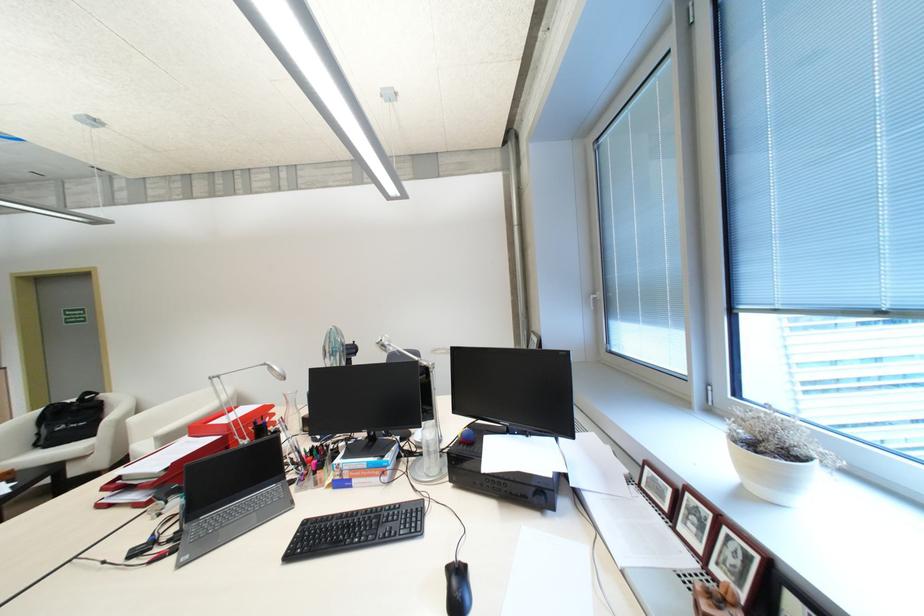
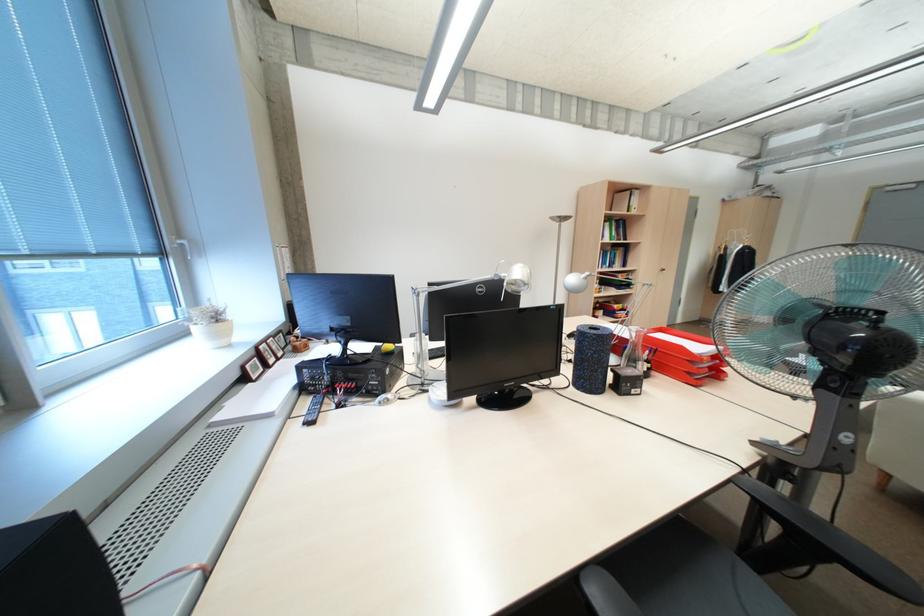
Question: I am providing you with two images of the same scene from different viewpoints. After the viewpoint changes to image2, which objects are now occluded?

Choices:
 (A) white flower pot
 (B) white and chrome bar
 (C) cabinet door handle
 (D) black receiver knob

Answer: (D)